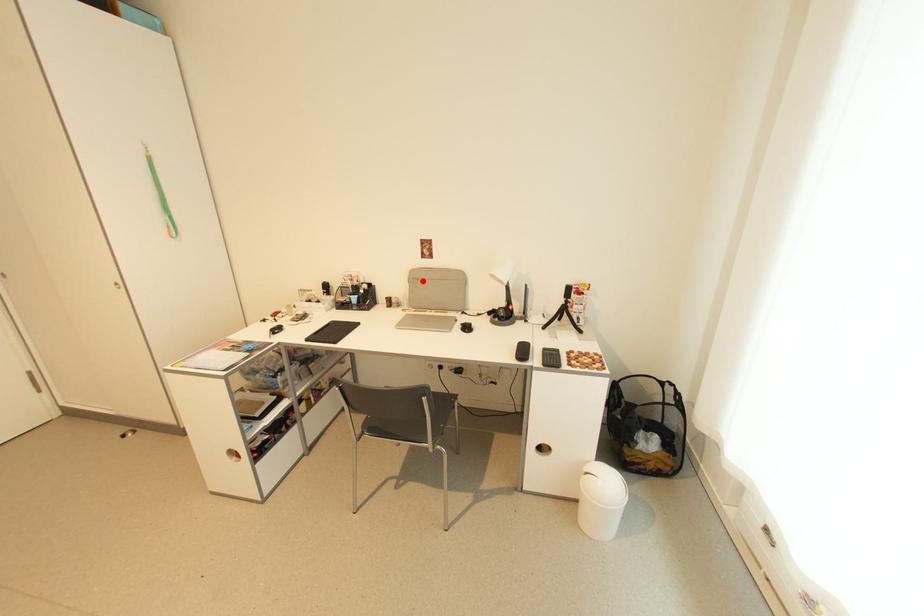
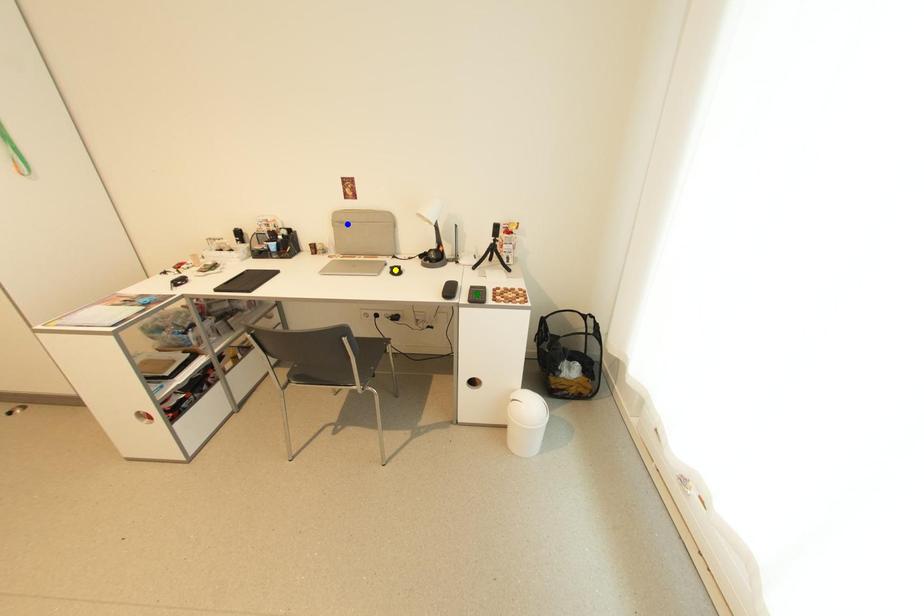
Question: I am providing you with two images of the same scene from different viewpoints. A red point is marked on the first image. You are given multiple points on the second image. Which point in image 2 is actually the same real-world point as the red point in image 1?

Choices:
 (A) green point
 (B) yellow point
 (C) blue point

Answer: (C)